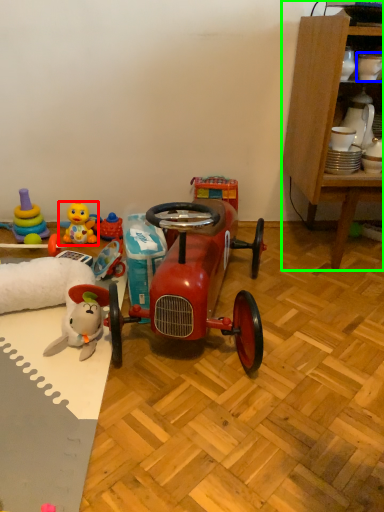
Question: Estimate the real-world distances between objects in this image. Which object is closer to toy (highlighted by a red box), toy (highlighted by a blue box) or cabinetry (highlighted by a green box)?

Choices:
 (A) toy
 (B) cabinetry

Answer: (B)